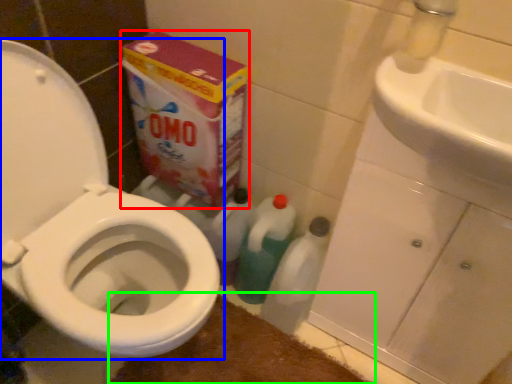
Question: Which object is positioned closest to cardboard box (highlighted by a red box)? Select from toilet (highlighted by a blue box) and bath mat (highlighted by a green box).

Choices:
 (A) toilet
 (B) bath mat

Answer: (A)